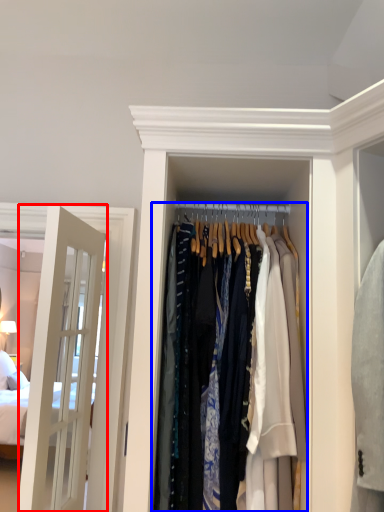
Question: Which of the following is the closest to the observer, door (highlighted by a red box) or closet (highlighted by a blue box)?

Choices:
 (A) door
 (B) closet

Answer: (B)